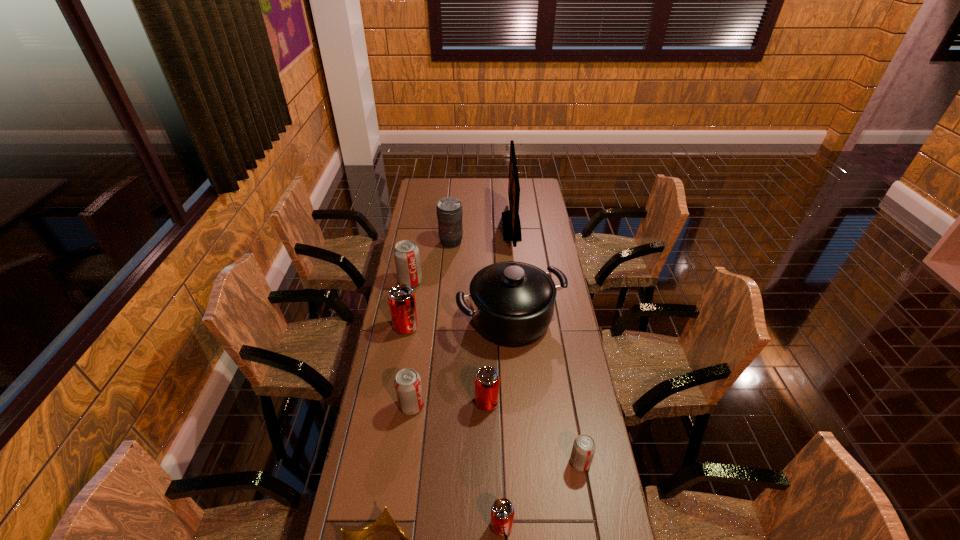
Locate an element on the screen. The image size is (960, 540). the smallest red soda can is located at coordinates (502, 511).

Where is `the rightmost soda can`? the rightmost soda can is located at coordinates (583, 450).

This screenshot has height=540, width=960. I want to click on the smallest gray soda can, so click(x=583, y=450).

I want to click on vacant space situated on the front-facing side of the monitor, so click(479, 226).

You are a GUI agent. You are given a task and a screenshot of the screen. Output one action in this format:
    pyautogui.click(x=<x>, y=<y>)
    Task: Click on the free space located 0.170m on the front-facing side of the monitor
    This screenshot has height=540, width=960.
    Given the screenshot: What is the action you would take?
    pyautogui.click(x=469, y=226)

What are the coordinates of `vacant space situated on the front-facing side of the monitor` in the screenshot? It's located at coord(426,226).

Locate an element on the screen. Image resolution: width=960 pixels, height=540 pixels. free space located 0.280m on the back of the saucepan is located at coordinates (506, 252).

At what (x,y) coordinates should I click in order to perform the action: click on vacant space located on the side of the telephoto lens where the control switches are located. Please return your answer as a coordinate pair (x, y). The width and height of the screenshot is (960, 540). Looking at the image, I should click on (450, 256).

Locate an element on the screen. Image resolution: width=960 pixels, height=540 pixels. free space located 0.280m on the front of the second farthest soda can is located at coordinates [x=394, y=400].

I want to click on blank space located on the front of the eighth nearest object, so click(397, 354).